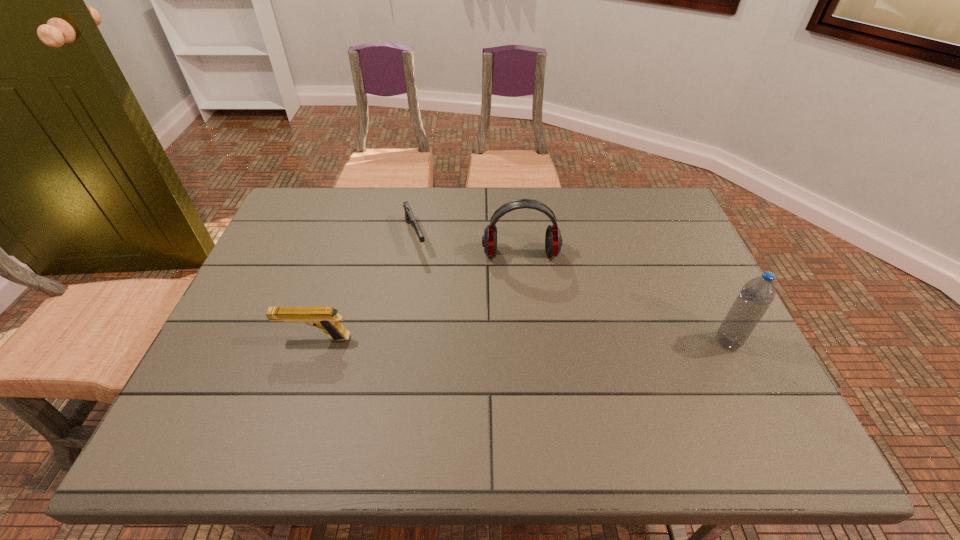
What are the coordinates of `the leftmost object` in the screenshot? It's located at (326, 318).

You are a GUI agent. You are given a task and a screenshot of the screen. Output one action in this format:
    pyautogui.click(x=<x>, y=<y>)
    Task: Click on the second shortest object
    This screenshot has height=540, width=960.
    Given the screenshot: What is the action you would take?
    pyautogui.click(x=326, y=318)

Locate an element on the screen. This screenshot has height=540, width=960. the tallest object is located at coordinates (756, 296).

Locate an element on the screen. the rightmost object is located at coordinates (756, 296).

Find the location of a particular element. The image size is (960, 540). earphone is located at coordinates (553, 240).

At what (x,y) coordinates should I click in order to perform the action: click on the second tallest object. Please return your answer as a coordinate pair (x, y). Looking at the image, I should click on (553, 240).

In order to click on the shortest object in this screenshot , I will do pyautogui.click(x=409, y=216).

Identify the location of gun. Image resolution: width=960 pixels, height=540 pixels. (409, 216).

Where is `vacant space positioned at the barrel of the leftmost object`? The image size is (960, 540). vacant space positioned at the barrel of the leftmost object is located at coordinates (226, 339).

The image size is (960, 540). I want to click on vacant region located at the barrel of the leftmost object, so click(226, 339).